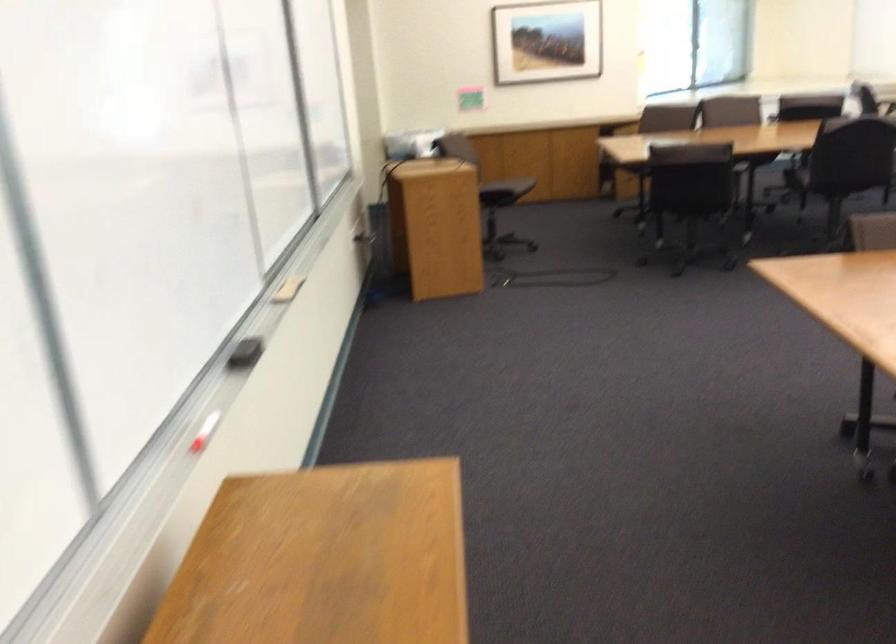
Locate an element on the screen. wooden whiteboard eraser is located at coordinates (288, 290).